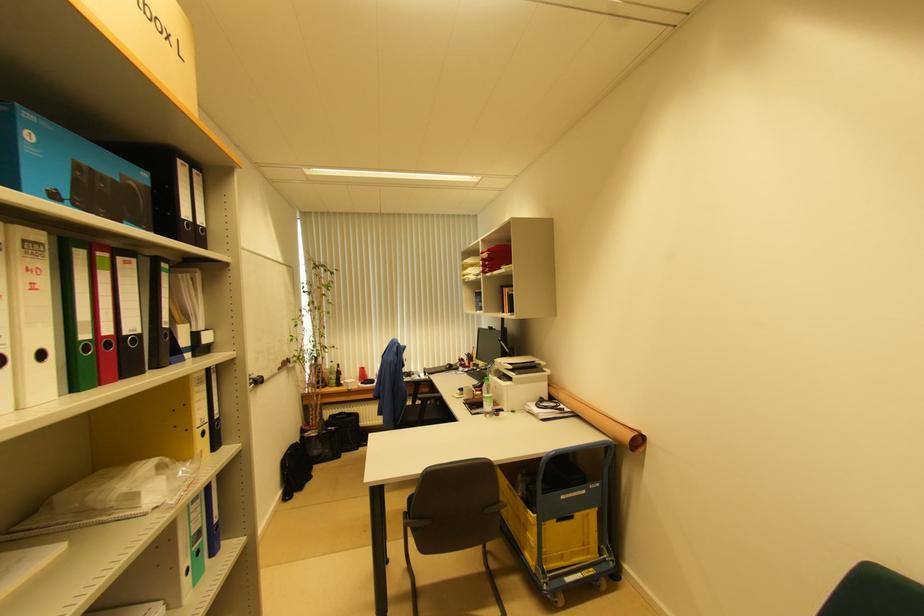
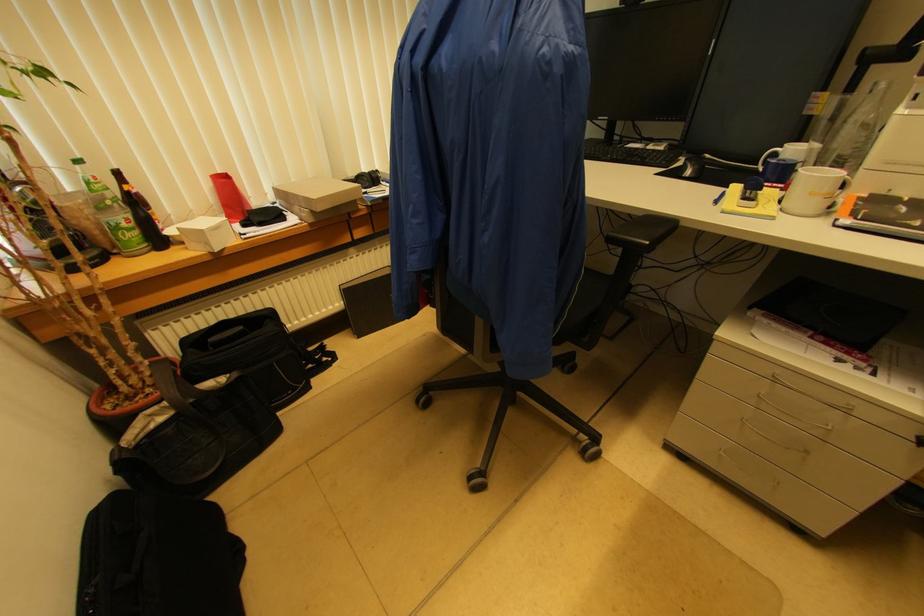
In the second image, find the point that corresponds to point 349,389 in the first image.

(209, 246)